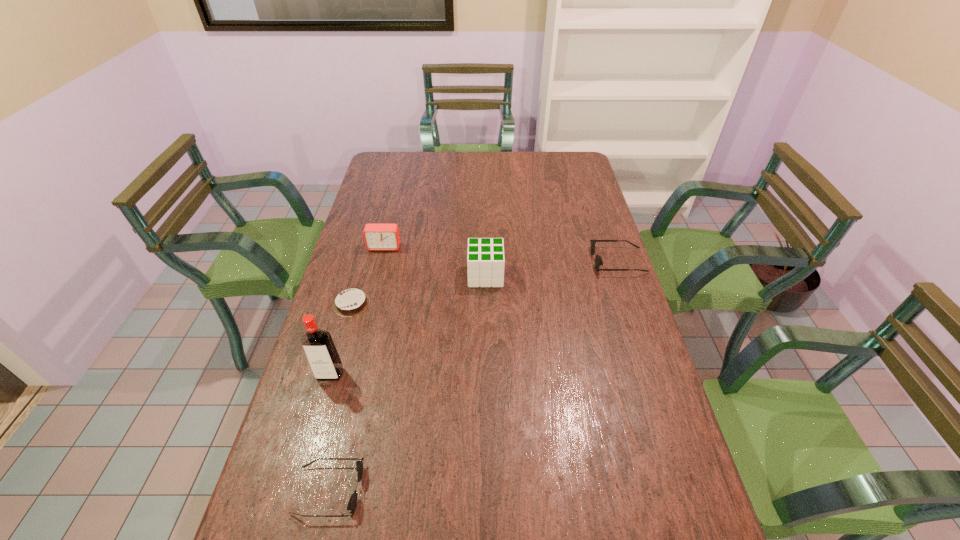
Identify the location of the tallest object. coord(320,350).

Image resolution: width=960 pixels, height=540 pixels. What are the coordinates of `free spot located 0.190m on the front-facing side of the nearest object` in the screenshot? It's located at (447, 490).

Identify the location of vacant space positioned on the front-facing side of the fourth tallest object. The image size is (960, 540). (545, 261).

The width and height of the screenshot is (960, 540). Identify the location of vacant region located on the front-facing side of the fourth tallest object. (502, 261).

The width and height of the screenshot is (960, 540). What are the coordinates of `vacant space situated 0.170m on the front-facing side of the fourth tallest object` in the screenshot? It's located at (542, 261).

Identify the location of vacant area situated on the front-facing side of the alarm clock. (367, 319).

I want to click on vacant space located on the red face of the second object from right to left, so click(x=350, y=275).

You are a GUI agent. You are given a task and a screenshot of the screen. Output one action in this format:
    pyautogui.click(x=<x>, y=<y>)
    Task: Click on the vacant space located 0.230m on the red face of the second object from right to left
    This screenshot has height=540, width=960.
    Given the screenshot: What is the action you would take?
    pyautogui.click(x=398, y=275)

The width and height of the screenshot is (960, 540). I want to click on vacant area situated on the red face of the second object from right to left, so click(x=429, y=275).

You are a GUI agent. You are given a task and a screenshot of the screen. Output one action in this format:
    pyautogui.click(x=<x>, y=<y>)
    Task: Click on the vacant point located 0.220m on the right of the shortest object
    
    Given the screenshot: What is the action you would take?
    pyautogui.click(x=441, y=304)